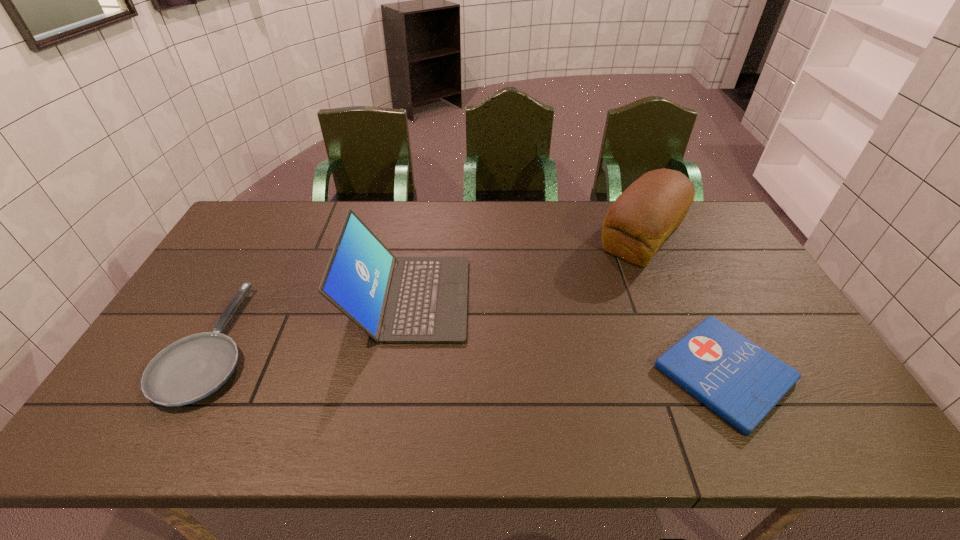
This screenshot has width=960, height=540. In the image, there is a desktop. What are the coordinates of `vacant space at the right edge` in the screenshot? It's located at (724, 273).

Find the location of a particular element. The width and height of the screenshot is (960, 540). free space at the far left corner of the desktop is located at coordinates (262, 211).

Find the location of `blank space at the far right corner of the desktop`. blank space at the far right corner of the desktop is located at coordinates (694, 223).

The image size is (960, 540). I want to click on free space between the first-aid kit and the bread, so click(683, 305).

This screenshot has width=960, height=540. Identify the location of empty location between the first-aid kit and the bread. (683, 305).

Identify the location of vacant area between the third object from right to left and the bread. This screenshot has width=960, height=540. (525, 268).

The height and width of the screenshot is (540, 960). I want to click on vacant space that is in between the leftmost object and the first-aid kit, so click(468, 358).

You are a GUI agent. You are given a task and a screenshot of the screen. Output one action in this format:
    pyautogui.click(x=<x>, y=<y>)
    Task: Click on the empty space between the laptop computer and the third tallest object
    
    Given the screenshot: What is the action you would take?
    pyautogui.click(x=310, y=321)

Where is `unoccupied position between the shortest object and the third tallest object`? The width and height of the screenshot is (960, 540). unoccupied position between the shortest object and the third tallest object is located at coordinates (468, 358).

Where is `vacant region between the third object from right to left and the leftmost object`? The image size is (960, 540). vacant region between the third object from right to left and the leftmost object is located at coordinates (310, 321).